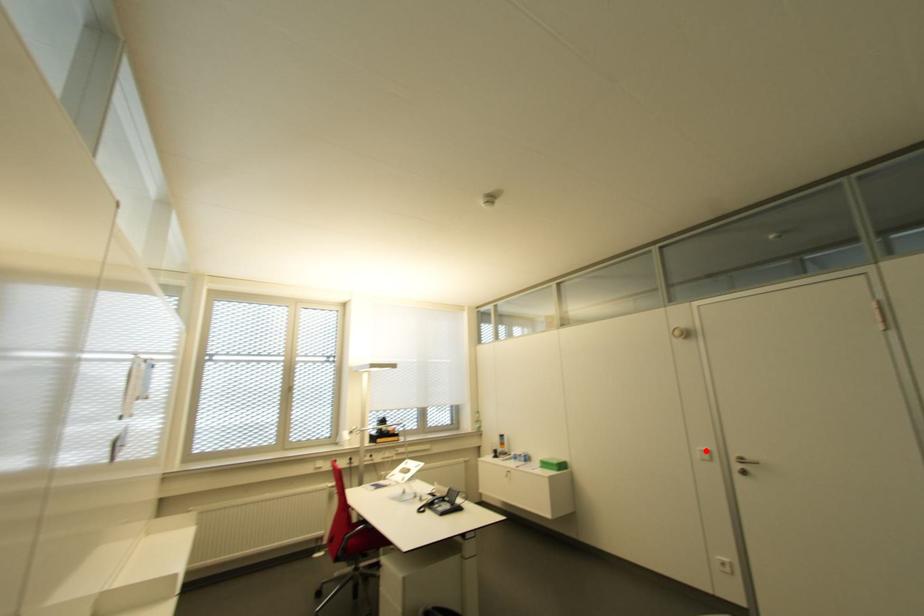
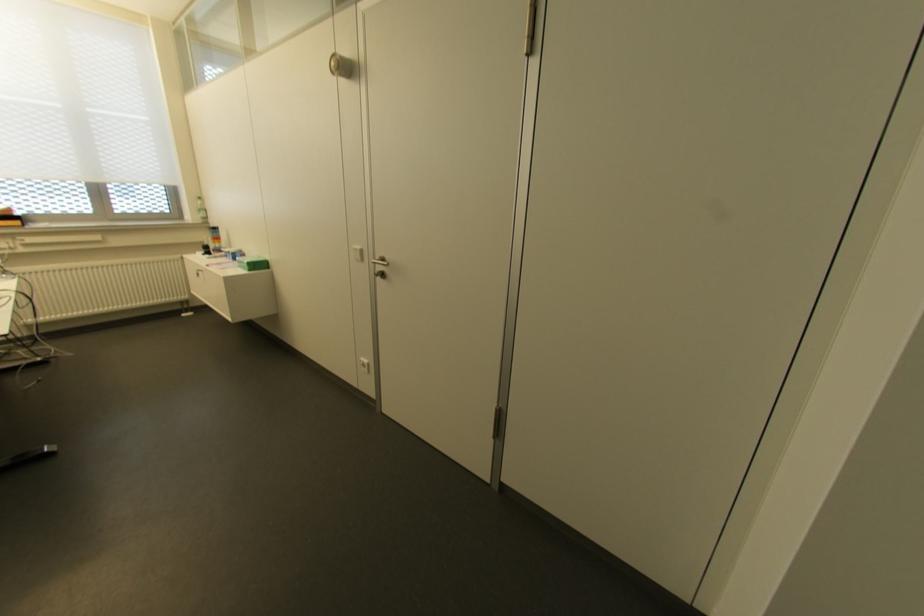
In the second image, find the point that corresponds to the highlighted location in the first image.

(358, 246)